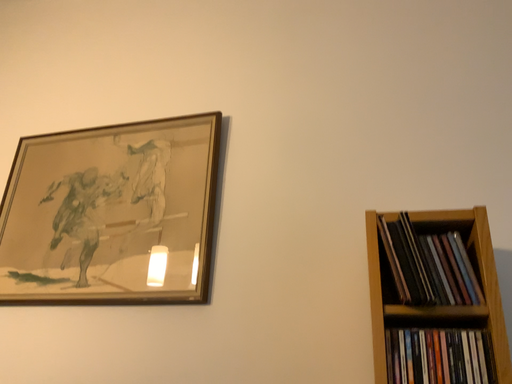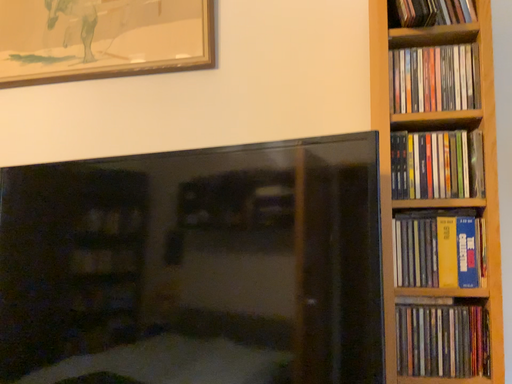
Question: How did the camera likely rotate when shooting the video?

Choices:
 (A) rotated downward
 (B) rotated upward

Answer: (A)